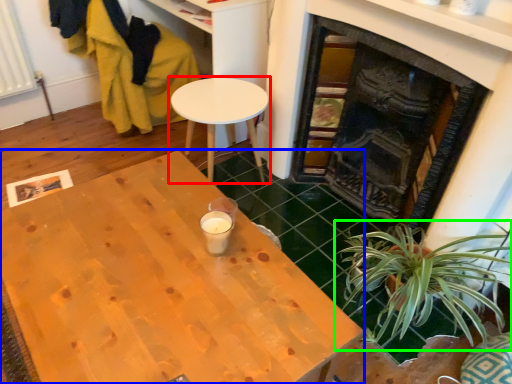
Question: Considering the real-world distances, which object is farthest from table (highlighted by a red box)? desk (highlighted by a blue box) or houseplant (highlighted by a green box)?

Choices:
 (A) desk
 (B) houseplant

Answer: (B)